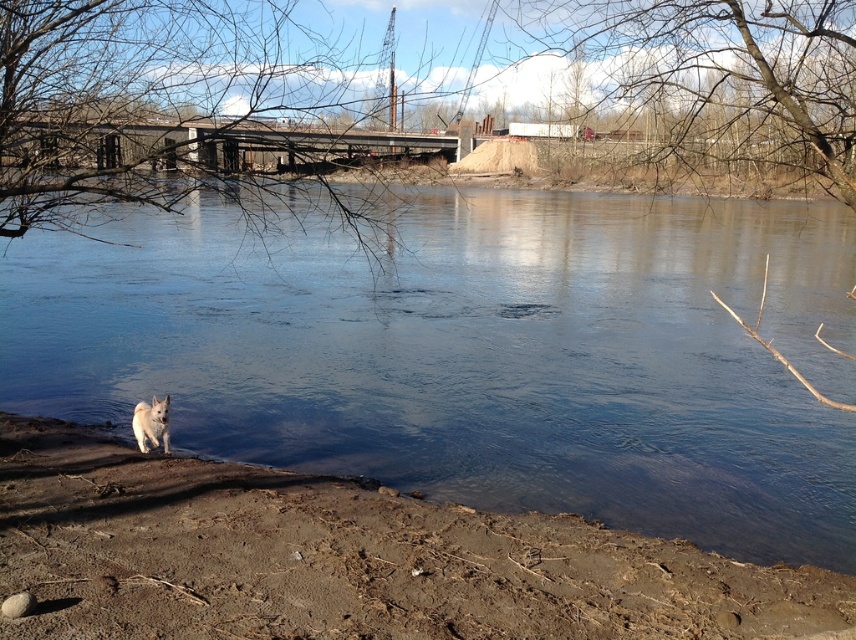
You are standing at the edge of the river and want to place a 20 feet long wooden board between the clear water at lower left and the brown dirt at lower left. Will the board reach both ends?

The distance between the clear water at lower left and the brown dirt at lower left is 22.32 feet, so the 20 feet long wooden board will not be long enough to span the entire distance between them.

You are standing at the riverside and see the clear water at lower left and the white fluffy dog at lower left. Which object is closer to the right side of the scene?

The clear water at lower left is to the right of the white fluffy dog at lower left, so the clear water at lower left is closer to the right side of the scene.

You are a photographer standing at the riverside and want to capture a photo of the brown dirt at lower left and the white fluffy dog at lower left. Which object occupies more horizontal space in the photo?

The brown dirt at lower left has a greater width than the white fluffy dog at lower left, so it occupies more horizontal space in the photo.